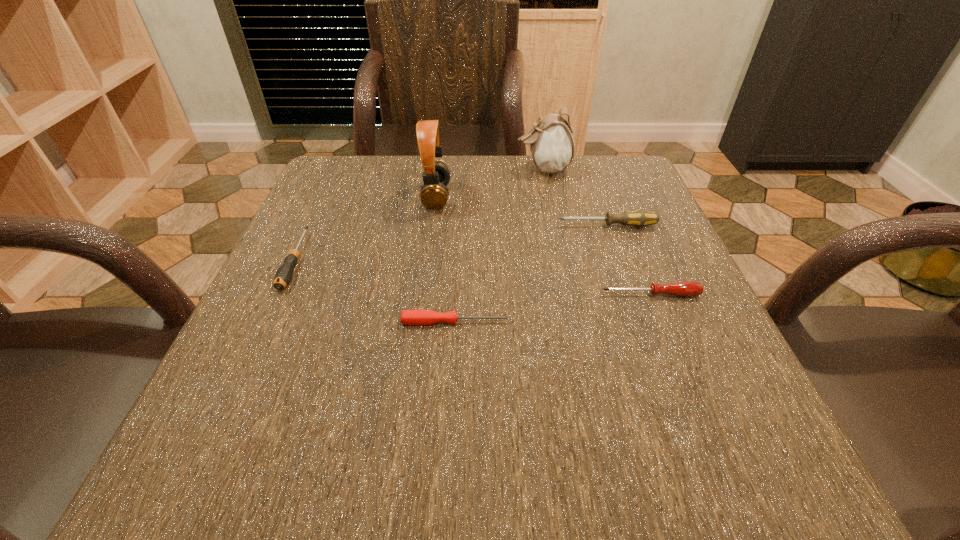
I want to click on pouch that is at the right edge, so click(x=552, y=146).

This screenshot has height=540, width=960. In order to click on object present at the far right corner in this screenshot , I will do `click(552, 146)`.

You are a GUI agent. You are given a task and a screenshot of the screen. Output one action in this format:
    pyautogui.click(x=<x>, y=<y>)
    Task: Click on the vacant space at the far edge
    This screenshot has width=960, height=540.
    Given the screenshot: What is the action you would take?
    pyautogui.click(x=479, y=176)

The image size is (960, 540). In order to click on free space at the left edge of the desktop in this screenshot , I will do `click(254, 322)`.

The image size is (960, 540). In the image, there is a desktop. What are the coordinates of `vacant area at the right edge` in the screenshot? It's located at (656, 422).

The height and width of the screenshot is (540, 960). Identify the location of vacant space at the far left corner of the desktop. (336, 195).

You are a GUI agent. You are given a task and a screenshot of the screen. Output one action in this format:
    pyautogui.click(x=<x>, y=<y>)
    Task: Click on the vacant space at the far right corner of the desktop
    Image resolution: width=960 pixels, height=540 pixels.
    Given the screenshot: What is the action you would take?
    pyautogui.click(x=619, y=208)

Where is `free space at the near right corner of the desktop`? This screenshot has width=960, height=540. free space at the near right corner of the desktop is located at coordinates (787, 470).

You are a GUI agent. You are given a task and a screenshot of the screen. Output one action in this format:
    pyautogui.click(x=<x>, y=<y>)
    Task: Click on the free point between the leftmost screwdriver and the tallest screwdriver
    
    Given the screenshot: What is the action you would take?
    pyautogui.click(x=451, y=243)

You are a GUI agent. You are given a task and a screenshot of the screen. Output one action in this format:
    pyautogui.click(x=<x>, y=<y>)
    Task: Click on the empty location between the headset and the shortest screwdriver
    The height and width of the screenshot is (540, 960).
    Given the screenshot: What is the action you would take?
    pyautogui.click(x=446, y=259)